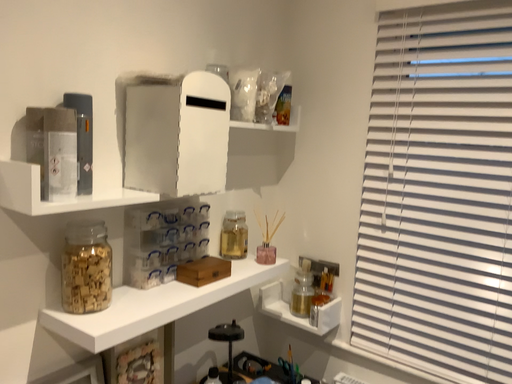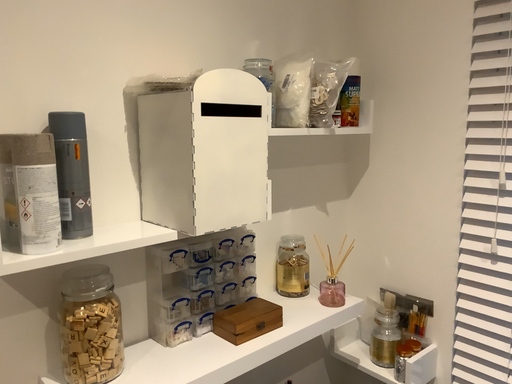
Question: How did the camera likely rotate when shooting the video?

Choices:
 (A) rotated left
 (B) rotated right

Answer: (A)